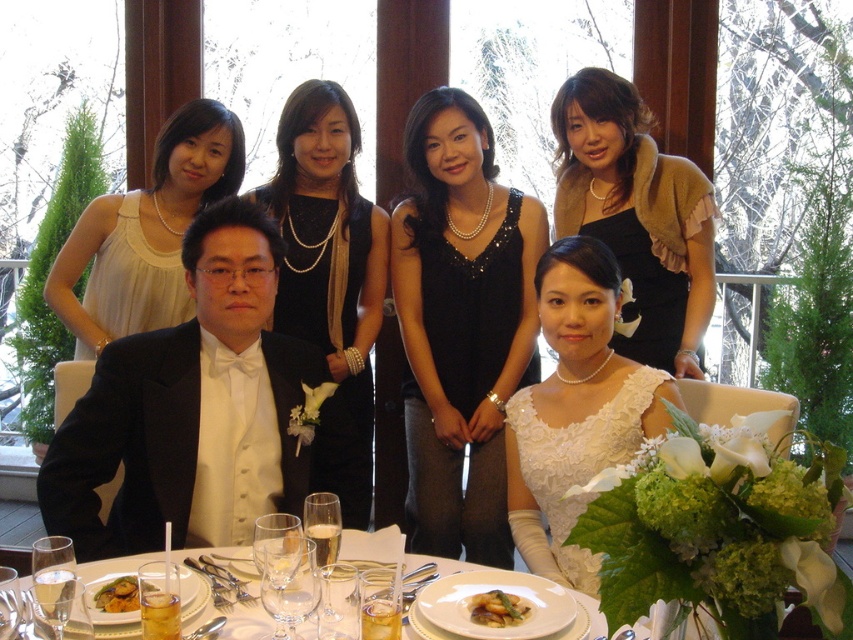
Based on the scene description provided, where is the black satin tuxedo at center located in terms of its 2D coordinates?

The black satin tuxedo at center is located at the 2D coordinates of point (x=177, y=397).

You are standing in the wedding reception and want to take a photo of both the point at coordinates point (93, 500) and point (595, 602). Which point should you focus on first to ensure both are in focus?

You should focus on the point at coordinates point (93, 500) first because it is closer to the camera than point (595, 602). This ensures that both points will be in focus when taking the photo.

You are a photographer at a wedding reception. You need to determine if the black satin tuxedo at center can be placed on the white porcelain plates at center without overlapping. Based on their sizes, what do you think?

The black satin tuxedo at center is thinner than white porcelain plates at center, so it can be placed on the plates without overlapping.